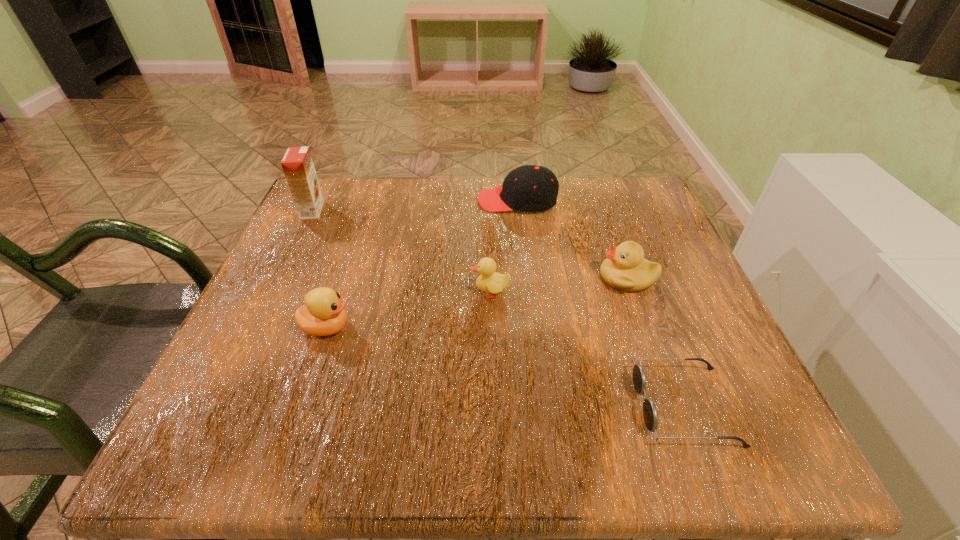
Where is `free location located on the front-facing side of the cap`? free location located on the front-facing side of the cap is located at coordinates (345, 200).

What are the coordinates of `free region located on the front-facing side of the cap` in the screenshot? It's located at (324, 200).

Where is `free spot located 0.130m on the front-facing side of the cap`? free spot located 0.130m on the front-facing side of the cap is located at coordinates (424, 200).

In order to click on free spot located 0.080m on the face of the leftmost duckling in this screenshot , I will do [398, 328].

Identify the location of free location located 0.220m at the face of the rightmost duckling. The height and width of the screenshot is (540, 960). (488, 278).

This screenshot has width=960, height=540. What are the coordinates of `vacant space situated 0.240m at the face of the rightmost duckling` in the screenshot? It's located at (477, 278).

Find the location of a particular element. This screenshot has height=540, width=960. free spot located 0.290m at the face of the rightmost duckling is located at coordinates click(x=452, y=278).

I want to click on free space located on the front-facing side of the second duckling from right to left, so click(x=422, y=293).

Locate an element on the screen. This screenshot has width=960, height=540. free point located on the front-facing side of the second duckling from right to left is located at coordinates (258, 293).

I want to click on blank space located on the front-facing side of the second duckling from right to left, so click(275, 293).